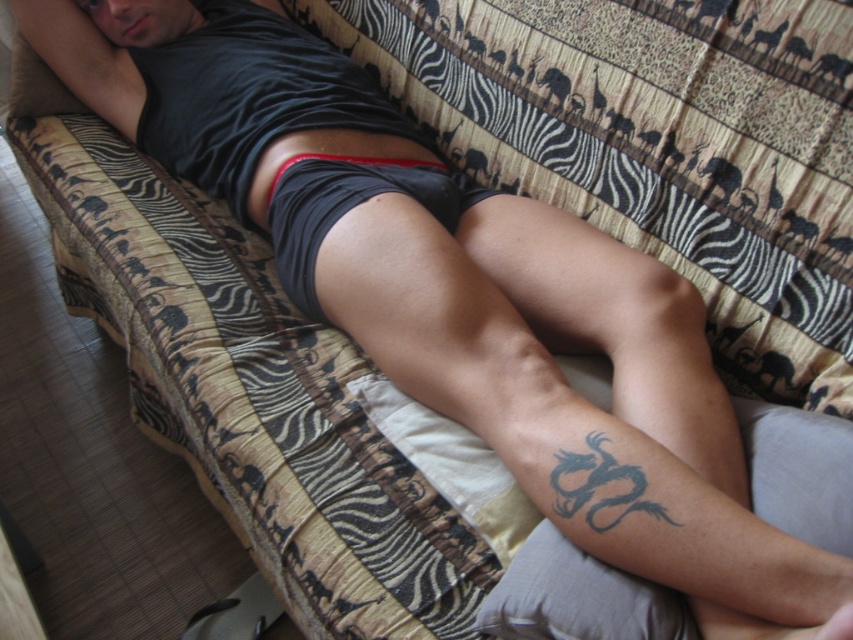
Question: Is gray fabric pillow at lower right below black matte shorts at center?

Choices:
 (A) no
 (B) yes

Answer: (B)

Question: Is gray fabric pillow at lower right bigger than black matte shorts at center?

Choices:
 (A) no
 (B) yes

Answer: (A)

Question: Which of the following is the closest to the observer?

Choices:
 (A) gray fabric pillow at lower right
 (B) black matte shorts at center

Answer: (A)

Question: Which object is closer to the camera taking this photo?

Choices:
 (A) black matte shorts at center
 (B) gray fabric pillow at lower right

Answer: (B)

Question: Can you confirm if gray fabric pillow at lower right is wider than black matte shorts at center?

Choices:
 (A) no
 (B) yes

Answer: (B)